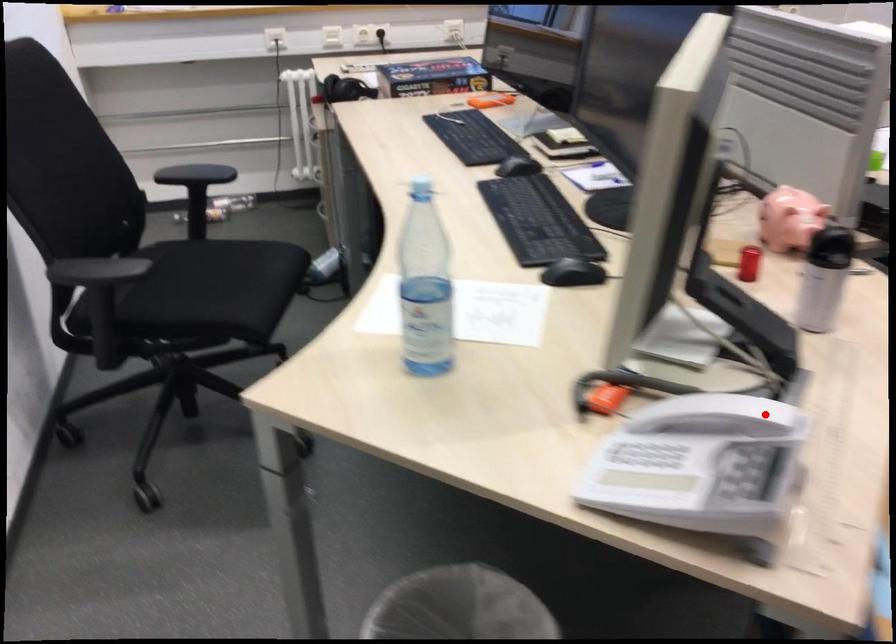
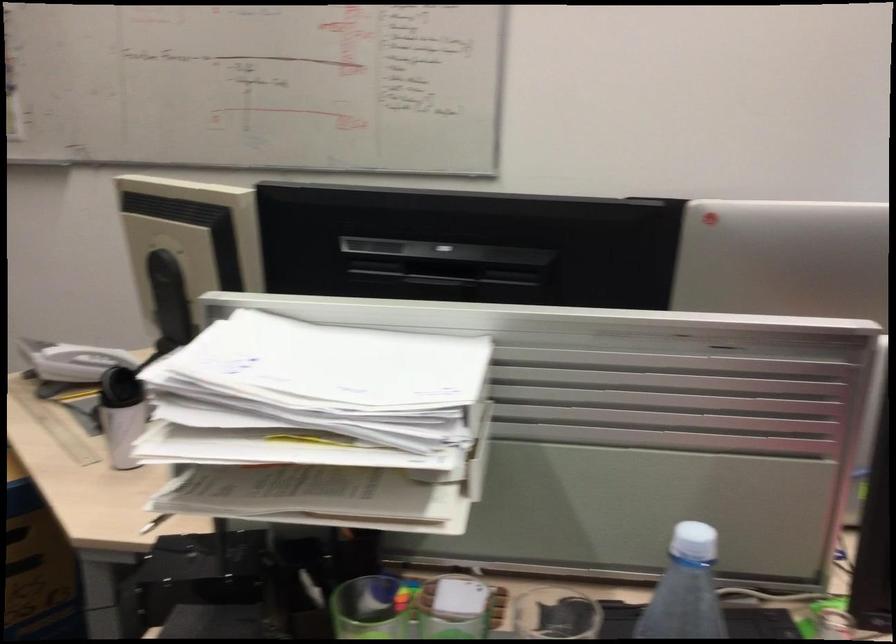
Question: I am providing you with two images of the same scene from different viewpoints. In image1, a red point is highlighted. Considering the same 3D point in image2, which of the following is correct?

Choices:
 (A) It is closer
 (B) It is farther

Answer: (B)